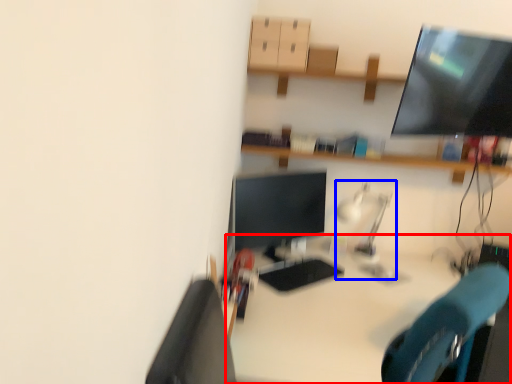
Question: Which object appears farthest to the camera in this image, desk (highlighted by a red box) or table lamp (highlighted by a blue box)?

Choices:
 (A) desk
 (B) table lamp

Answer: (B)